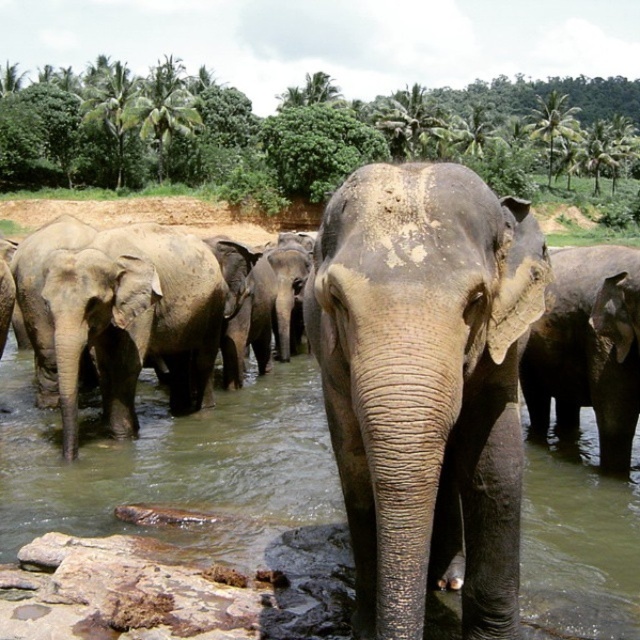
Question: Which point appears closest to the camera in this image?

Choices:
 (A) (300, 428)
 (B) (324, 349)

Answer: (B)

Question: Is gray matte elephant at center smaller than brown muddy water at center?

Choices:
 (A) no
 (B) yes

Answer: (A)

Question: Considering the relative positions of gray matte elephant at left and gray textured elephant at center in the image provided, where is gray matte elephant at left located with respect to gray textured elephant at center?

Choices:
 (A) above
 (B) below

Answer: (A)

Question: Which of the following is the closest to the observer?

Choices:
 (A) gray matte elephant at left
 (B) gray textured elephant at center
 (C) brown muddy water at center
 (D) gray matte elephant at center

Answer: (D)

Question: Which of the following is the farthest from the observer?

Choices:
 (A) (100, 321)
 (B) (570, 352)

Answer: (B)

Question: Can you confirm if gray matte elephant at center is wider than gray matte elephant at left?

Choices:
 (A) no
 (B) yes

Answer: (A)